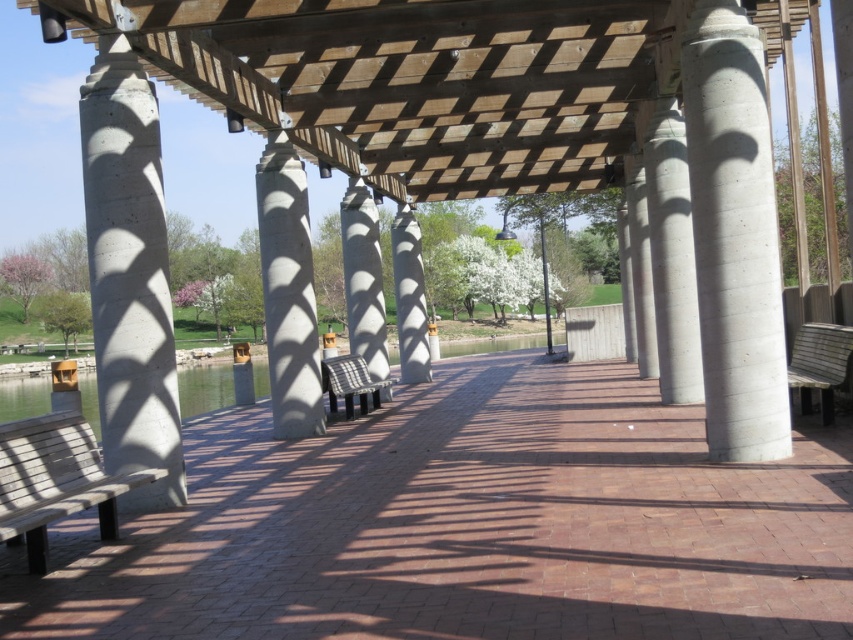
Question: Is gray concrete column at left to the left of concrete/rough textured bench at center from the viewer's perspective?

Choices:
 (A) no
 (B) yes

Answer: (B)

Question: Does concrete at center have a smaller size compared to concrete/rough textured bench at center?

Choices:
 (A) yes
 (B) no

Answer: (B)

Question: Estimate the real-world distances between objects in this image. Which object is farther from the wooden bench at center?

Choices:
 (A) concrete/rough textured bench at center
 (B) gray concrete column at right
 (C) gray concrete column at left

Answer: (A)

Question: Is concrete at center to the right of wooden bench at center from the viewer's perspective?

Choices:
 (A) no
 (B) yes

Answer: (A)

Question: Which object appears closest to the camera in this image?

Choices:
 (A) gray concrete column at right
 (B) wooden bench at lower left
 (C) clear water at center

Answer: (B)

Question: Among these objects, which one is farthest from the camera?

Choices:
 (A) concrete at center
 (B) brown brick path at center
 (C) concrete textured pillar at center
 (D) clear water at center

Answer: (D)